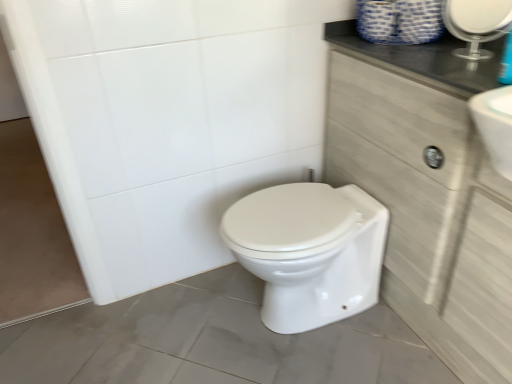
The image size is (512, 384). Describe the element at coordinates (476, 24) in the screenshot. I see `clear glass mirror at upper right` at that location.

This screenshot has width=512, height=384. In order to click on white glossy bidet at center in this screenshot , I will do `click(309, 251)`.

How different are the orientations of white glossy bidet at center and clear glass mirror at upper right in degrees?

There is a 36.1-degree angle between the facing directions of white glossy bidet at center and clear glass mirror at upper right.

Is point (336, 251) in front of point (470, 10)?

No.

Which is more to the right, white glossy bidet at center or clear glass mirror at upper right?

From the viewer's perspective, clear glass mirror at upper right appears more on the right side.

Is white glossy bidet at center further to the viewer compared to clear glass mirror at upper right?

Yes, it is behind clear glass mirror at upper right.

How different are the orientations of light wood cabinet at right and clear glass mirror at upper right in degrees?

36.3 degrees separate the facing orientations of light wood cabinet at right and clear glass mirror at upper right.

Is the surface of light wood cabinet at right in direct contact with clear glass mirror at upper right?

light wood cabinet at right and clear glass mirror at upper right are not in contact.

Does light wood cabinet at right come behind clear glass mirror at upper right?

No, it is not.

Considering the relative sizes of light wood cabinet at right and clear glass mirror at upper right in the image provided, is light wood cabinet at right thinner than clear glass mirror at upper right?

In fact, light wood cabinet at right might be wider than clear glass mirror at upper right.

Could you tell me if white glossy bidet at center is turned towards light wood cabinet at right?

No, white glossy bidet at center is not facing towards light wood cabinet at right.

Looking at the image, does white glossy bidet at center seem bigger or smaller compared to light wood cabinet at right?

In the image, white glossy bidet at center appears to be smaller than light wood cabinet at right.

Would you say white glossy bidet at center is outside light wood cabinet at right?

Yes, white glossy bidet at center is outside of light wood cabinet at right.

Could you tell me if light wood cabinet at right is turned towards white glossy bidet at center?

Yes, light wood cabinet at right faces towards white glossy bidet at center.

Considering the sizes of light wood cabinet at right and white glossy bidet at center in the image, is light wood cabinet at right taller or shorter than white glossy bidet at center?

light wood cabinet at right is taller than white glossy bidet at center.

Find the location of a particular element. This screenshot has width=512, height=384. bidet below the light wood cabinet at right (from a real-world perspective) is located at coordinates (309, 251).

Can you confirm if light wood cabinet at right is thinner than white glossy bidet at center?

Correct, the width of light wood cabinet at right is less than that of white glossy bidet at center.

Which of these two, clear glass mirror at upper right or white glossy bidet at center, is bigger?

white glossy bidet at center.

This screenshot has width=512, height=384. Find the location of `mirror that is in front of the white glossy bidet at center`. mirror that is in front of the white glossy bidet at center is located at coordinates (476, 24).

Which is more to the left, clear glass mirror at upper right or white glossy bidet at center?

Positioned to the left is white glossy bidet at center.

How many degrees apart are the facing directions of clear glass mirror at upper right and white glossy bidet at center?

The facing directions of clear glass mirror at upper right and white glossy bidet at center are 36.1 degrees apart.

Is the depth of clear glass mirror at upper right greater than that of light wood cabinet at right?

Yes, clear glass mirror at upper right is behind light wood cabinet at right.

Which object is positioned more to the left, clear glass mirror at upper right or light wood cabinet at right?

light wood cabinet at right.

Is clear glass mirror at upper right situated inside light wood cabinet at right or outside?

clear glass mirror at upper right is spatially situated outside light wood cabinet at right.

The width and height of the screenshot is (512, 384). What are the coordinates of `mirror in front of the white glossy bidet at center` in the screenshot? It's located at tap(476, 24).

Identify the location of cabinetry below the clear glass mirror at upper right (from a real-world perspective). 428,190.

When comparing their distances from light wood cabinet at right, does clear glass mirror at upper right or white glossy bidet at center seem further?

Based on the image, clear glass mirror at upper right appears to be further to light wood cabinet at right.

Looking at the image, which one is located further to clear glass mirror at upper right, white glossy bidet at center or light wood cabinet at right?

white glossy bidet at center is positioned further to the anchor clear glass mirror at upper right.

Based on the photo, estimate the real-world distances between objects in this image. Which object is closer to white glossy bidet at center, light wood cabinet at right or clear glass mirror at upper right?

Based on the image, light wood cabinet at right appears to be nearer to white glossy bidet at center.

Based on their spatial positions, is white glossy bidet at center or clear glass mirror at upper right closer to light wood cabinet at right?

white glossy bidet at center.

From the picture: Estimate the real-world distances between objects in this image. Which object is closer to white glossy bidet at center, clear glass mirror at upper right or light wood cabinet at right?

Among the two, light wood cabinet at right is located nearer to white glossy bidet at center.

Looking at the image, which one is located closer to clear glass mirror at upper right, light wood cabinet at right or white glossy bidet at center?

light wood cabinet at right is positioned closer to the anchor clear glass mirror at upper right.

Locate an element on the screen. cabinetry between clear glass mirror at upper right and white glossy bidet at center in the vertical direction is located at coordinates (428, 190).